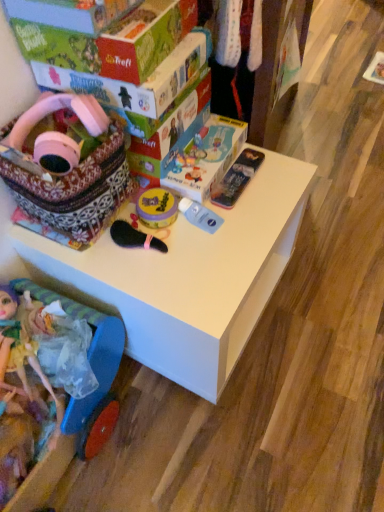
Question: Could you tell me if transparent plastic bottle at center, positioned as the fifth toy in left-to-right order, is turned towards pink matte headphones at upper left, the second toy viewed from the left?

Choices:
 (A) yes
 (B) no

Answer: (B)

Question: Is the depth of transparent plastic bottle at center, which is the second toy from right to left, greater than that of pink matte headphones at upper left, the second toy viewed from the left?

Choices:
 (A) no
 (B) yes

Answer: (B)

Question: Is transparent plastic bottle at center, which is the second toy from right to left, facing away from pink matte headphones at upper left, which is counted as the fifth toy, starting from the right?

Choices:
 (A) no
 (B) yes

Answer: (A)

Question: From the image's perspective, would you say transparent plastic bottle at center, which is the second toy from right to left, is positioned over pink matte headphones at upper left, which is counted as the fifth toy, starting from the right?

Choices:
 (A) yes
 (B) no

Answer: (B)

Question: Is pink matte headphones at upper left, the second toy viewed from the left, inside transparent plastic bottle at center, positioned as the fifth toy in left-to-right order?

Choices:
 (A) no
 (B) yes

Answer: (A)

Question: From the image's perspective, is white matte table at center located above or below matte cardboard box at upper center, which is counted as the 2th box, starting from the front?

Choices:
 (A) below
 (B) above

Answer: (A)

Question: Based on their sizes in the image, would you say white matte table at center is bigger or smaller than matte cardboard box at upper center, the 1th box positioned from the back?

Choices:
 (A) small
 (B) big

Answer: (B)

Question: Is white matte table at center situated inside matte cardboard box at upper center, which is counted as the 2th box, starting from the front, or outside?

Choices:
 (A) inside
 (B) outside

Answer: (B)

Question: Considering the positions of white matte table at center and matte cardboard box at upper center, which is counted as the 2th box, starting from the front, in the image, is white matte table at center taller or shorter than matte cardboard box at upper center, which is counted as the 2th box, starting from the front,?

Choices:
 (A) short
 (B) tall

Answer: (B)

Question: Looking at their shapes, would you say plastic doll at lower left, placed as the sixth toy when sorted from right to left, is wider or thinner than matte cardboard box at upper center, the 1th box positioned from the back?

Choices:
 (A) thin
 (B) wide

Answer: (A)

Question: From the image's perspective, relative to matte cardboard box at upper center, which is counted as the 2th box, starting from the front, is plastic doll at lower left, placed as the sixth toy when sorted from right to left, above or below?

Choices:
 (A) above
 (B) below

Answer: (B)

Question: Is point (24, 361) closer or farther from the camera than point (114, 86)?

Choices:
 (A) farther
 (B) closer

Answer: (A)

Question: From a real-world perspective, is plastic doll at lower left, which appears as the first toy when viewed from the left, physically located above or below matte cardboard box at upper center, the 1th box positioned from the back?

Choices:
 (A) above
 (B) below

Answer: (B)

Question: Looking at their shapes, would you say plastic doll at lower left, placed as the sixth toy when sorted from right to left, is wider or thinner than green cardboard box at upper left, which ranks as the 2th box in back-to-front order?

Choices:
 (A) wide
 (B) thin

Answer: (A)

Question: Is plastic doll at lower left, placed as the sixth toy when sorted from right to left, inside the boundaries of green cardboard box at upper left, which ranks as the 2th box in back-to-front order, or outside?

Choices:
 (A) inside
 (B) outside

Answer: (B)